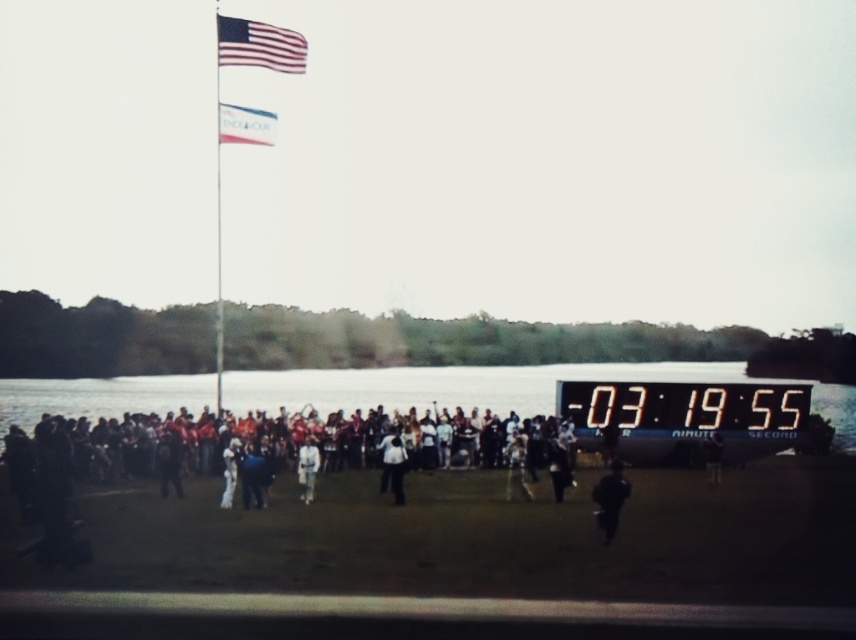
Question: Which of the following is the farthest from the observer?

Choices:
 (A) white fabric flag at upper center
 (B) metallic flag pole at upper left
 (C) clear water at lower center
 (D) black matte person at lower right

Answer: (C)

Question: Among these points, which one is farthest from the camera?

Choices:
 (A) (531, 433)
 (B) (259, 51)
 (C) (241, 42)

Answer: (A)

Question: Is metallic flag pole at upper left closer to camera compared to dark gray suit at center?

Choices:
 (A) yes
 (B) no

Answer: (B)

Question: Does dark clothing crowd at center appear over clear water at lower center?

Choices:
 (A) no
 (B) yes

Answer: (B)

Question: Which point is farther to the camera?

Choices:
 (A) dark clothing crowd at center
 (B) dark gray suit at center

Answer: (B)

Question: Does clear water at lower center have a lesser width compared to white fabric flag at upper center?

Choices:
 (A) yes
 (B) no

Answer: (B)